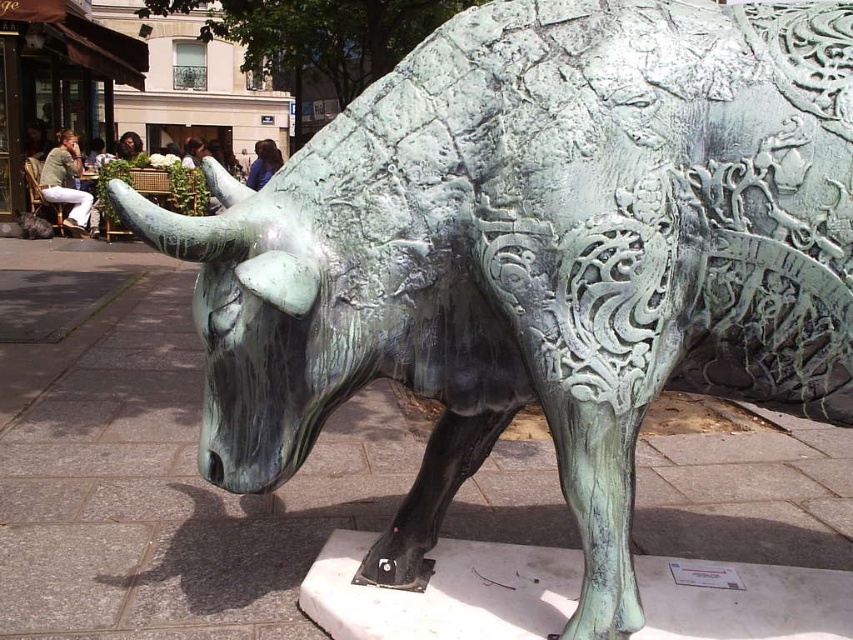
You are an artist who wants to paint a mural of the bull sculpture. You have a green cotton shirt at left and a blue fabric at center as reference materials. Can you walk between them without moving either item if you need a 1.5 meter path?

The green cotton shirt at left and blue fabric at center are 2.27 meters apart, so yes, you can walk between them with a 1.5 meter path since the distance is sufficient.

From the picture: You are an artist standing 3 meters away from the blue fabric at center and dark brown hair at upper center. You want to place a new sculpture between them. Can you fit it there if the sculpture is 1.5 meters wide?

The blue fabric at center and dark brown hair at upper center are 2.04 meters apart from each other. The sculpture is 1.5 meters wide, which is narrower than the 2.04 meters space between them. Therefore, the sculpture can be placed between them.